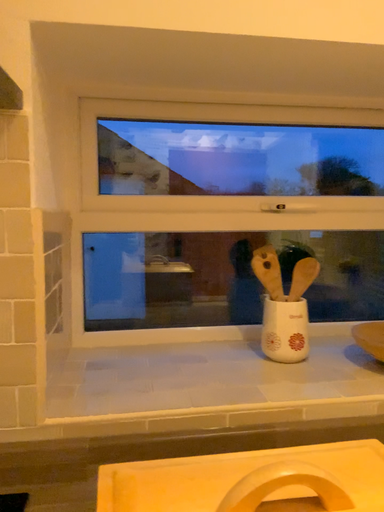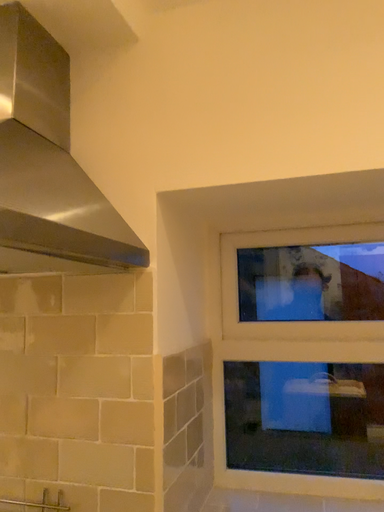
Question: How did the camera likely rotate when shooting the video?

Choices:
 (A) rotated right
 (B) rotated left

Answer: (B)